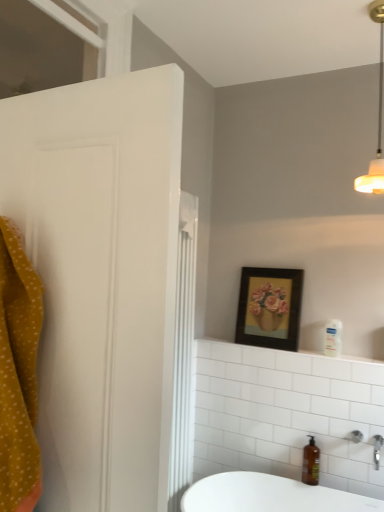
Question: From a real-world perspective, is white glossy shelf at upper center beneath silver metallic faucet at lower right?

Choices:
 (A) yes
 (B) no

Answer: (B)

Question: Is white glossy shelf at upper center bigger than silver metallic faucet at lower right?

Choices:
 (A) no
 (B) yes

Answer: (B)

Question: From the image's perspective, is white glossy shelf at upper center below silver metallic faucet at lower right?

Choices:
 (A) yes
 (B) no

Answer: (B)

Question: Does white glossy shelf at upper center have a lesser width compared to silver metallic faucet at lower right?

Choices:
 (A) yes
 (B) no

Answer: (A)

Question: From the image's perspective, is white glossy shelf at upper center located above silver metallic faucet at lower right?

Choices:
 (A) no
 (B) yes

Answer: (B)

Question: Does white glossy shelf at upper center have a smaller size compared to silver metallic faucet at lower right?

Choices:
 (A) no
 (B) yes

Answer: (A)

Question: Is the position of transparent glass window at upper left less distant than that of silver metallic faucet at lower right?

Choices:
 (A) yes
 (B) no

Answer: (A)

Question: Is transparent glass window at upper left placed right next to silver metallic faucet at lower right?

Choices:
 (A) yes
 (B) no

Answer: (B)

Question: Is transparent glass window at upper left outside of silver metallic faucet at lower right?

Choices:
 (A) no
 (B) yes

Answer: (B)

Question: Is transparent glass window at upper left oriented towards silver metallic faucet at lower right?

Choices:
 (A) yes
 (B) no

Answer: (B)

Question: Considering the relative sizes of transparent glass window at upper left and silver metallic faucet at lower right in the image provided, is transparent glass window at upper left shorter than silver metallic faucet at lower right?

Choices:
 (A) no
 (B) yes

Answer: (A)

Question: From a real-world perspective, is transparent glass window at upper left located beneath silver metallic faucet at lower right?

Choices:
 (A) yes
 (B) no

Answer: (B)

Question: Is transparent glass window at upper left next to white glossy shelf at upper center and touching it?

Choices:
 (A) yes
 (B) no

Answer: (B)